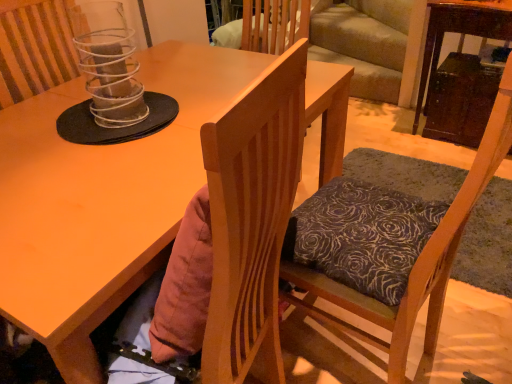
Identify the location of matte wood desk at center. (102, 200).

Locate an element on the screen. Image resolution: width=512 pixels, height=384 pixels. wooden chair with patterned cushion at center is located at coordinates (414, 265).

Locate an element on the screen. The height and width of the screenshot is (384, 512). matte wood desk at center is located at coordinates (102, 200).

Does matte wood desk at center touch wooden chair with patterned cushion at center?

There is a gap between matte wood desk at center and wooden chair with patterned cushion at center.

Is matte wood desk at center facing towards wooden chair with patterned cushion at center?

Yes, matte wood desk at center is facing wooden chair with patterned cushion at center.

From the picture: Which object is further away from the camera, matte wood desk at center or wooden chair with patterned cushion at center?

Positioned behind is matte wood desk at center.

Between matte wood desk at center and clear plastic spiral at upper center, which one is positioned in front?

Positioned in front is matte wood desk at center.

Is matte wood desk at center facing away from clear plastic spiral at upper center?

No, matte wood desk at center's orientation is not away from clear plastic spiral at upper center.

Is matte wood desk at center located outside clear plastic spiral at upper center?

That's correct, matte wood desk at center is outside of clear plastic spiral at upper center.

Who is bigger, clear plastic spiral at upper center or matte wood desk at center?

matte wood desk at center is bigger.

Which of these two, clear plastic spiral at upper center or matte wood desk at center, stands shorter?

Standing shorter between the two is clear plastic spiral at upper center.

From a real-world perspective, does clear plastic spiral at upper center stand above matte wood desk at center?

Indeed, from a real-world perspective, clear plastic spiral at upper center stands above matte wood desk at center.

Does wooden chair with patterned cushion at center turn towards clear plastic spiral at upper center?

No, wooden chair with patterned cushion at center is not aimed at clear plastic spiral at upper center.

Does wooden chair with patterned cushion at center appear on the left side of clear plastic spiral at upper center?

Incorrect, wooden chair with patterned cushion at center is not on the left side of clear plastic spiral at upper center.

Where is `chair that is on the right side of clear plastic spiral at upper center`? chair that is on the right side of clear plastic spiral at upper center is located at coordinates (414, 265).

Looking at their sizes, would you say wooden chair with patterned cushion at center is wider or thinner than clear plastic spiral at upper center?

wooden chair with patterned cushion at center is wider than clear plastic spiral at upper center.

Is wooden chair with patterned cushion at center at the right side of matte wood desk at center?

Yes, wooden chair with patterned cushion at center is to the right of matte wood desk at center.

Are wooden chair with patterned cushion at center and matte wood desk at center far apart?

Actually, wooden chair with patterned cushion at center and matte wood desk at center are a little close together.

Does wooden chair with patterned cushion at center have a smaller size compared to matte wood desk at center?

Yes, wooden chair with patterned cushion at center is smaller than matte wood desk at center.

Is matte wood desk at center surrounded by wooden chair with patterned cushion at center?

No, matte wood desk at center is located outside of wooden chair with patterned cushion at center.

Looking at their sizes, would you say clear plastic spiral at upper center is wider or thinner than wooden chair with patterned cushion at center?

Clearly, clear plastic spiral at upper center has less width compared to wooden chair with patterned cushion at center.

Can you tell me how much clear plastic spiral at upper center and wooden chair with patterned cushion at center differ in facing direction?

They differ by 171 degrees in their facing directions.

Considering the positions of objects clear plastic spiral at upper center and wooden chair with patterned cushion at center in the image provided, who is more to the right, clear plastic spiral at upper center or wooden chair with patterned cushion at center?

wooden chair with patterned cushion at center.

Is clear plastic spiral at upper center facing towards wooden chair with patterned cushion at center?

Yes, clear plastic spiral at upper center is aimed at wooden chair with patterned cushion at center.

At what (x,y) coordinates should I click in order to perform the action: click on chair above the matte wood desk at center (from a real-world perspective). Please return your answer as a coordinate pair (x, y). Looking at the image, I should click on (414, 265).

Find the location of a particular element. The image size is (512, 384). candle holder above the matte wood desk at center (from the image's perspective) is located at coordinates (111, 69).

Estimate the real-world distances between objects in this image. Which object is further from wooden chair with patterned cushion at center, matte wood desk at center or clear plastic spiral at upper center?

clear plastic spiral at upper center.

When comparing their distances from clear plastic spiral at upper center, does matte wood desk at center or wooden chair with patterned cushion at center seem further?

wooden chair with patterned cushion at center.

From the image, which object appears to be farther from clear plastic spiral at upper center, wooden chair with patterned cushion at center or matte wood desk at center?

wooden chair with patterned cushion at center is positioned further to the anchor clear plastic spiral at upper center.

Which object lies further to the anchor point wooden chair with patterned cushion at center, clear plastic spiral at upper center or matte wood desk at center?

clear plastic spiral at upper center is positioned further to the anchor wooden chair with patterned cushion at center.

From the image, which object appears to be farther from matte wood desk at center, wooden chair with patterned cushion at center or clear plastic spiral at upper center?

wooden chair with patterned cushion at center.

When comparing their distances from matte wood desk at center, does clear plastic spiral at upper center or wooden chair with patterned cushion at center seem closer?

Based on the image, clear plastic spiral at upper center appears to be nearer to matte wood desk at center.

Image resolution: width=512 pixels, height=384 pixels. In order to click on desk between clear plastic spiral at upper center and wooden chair with patterned cushion at center in the horizontal direction in this screenshot , I will do `click(102, 200)`.